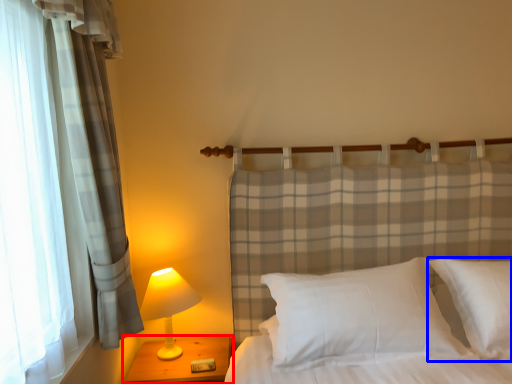
Question: Which of the following is the closest to the observer, nightstand (highlighted by a red box) or pillow (highlighted by a blue box)?

Choices:
 (A) nightstand
 (B) pillow

Answer: (B)